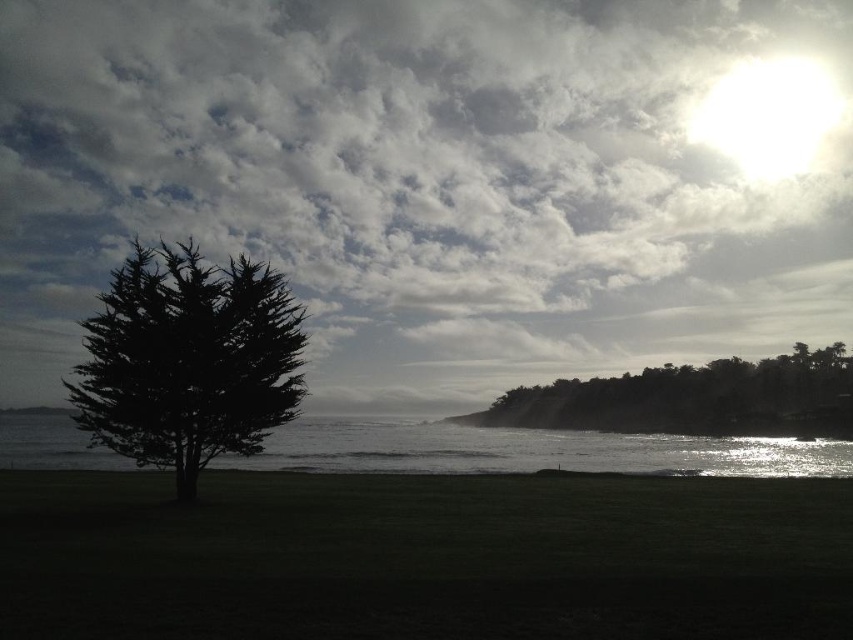
You are a photographer wanting to capture the entire scene in one shot. Given that your camera can only focus on one object at a time, which object between the glistening silver water at center and the dark green textured trees at lower right should you choose to ensure the larger object is in focus?

The glistening silver water at center is larger in size than the dark green textured trees at lower right, so you should focus on the glistening silver water at center to ensure the larger object is in focus.

You are an artist sketching the coastal scene. You want to ensure the black matte tree at left and the dark green textured trees at lower right are proportionally accurate. Based on the scene, which tree should you draw wider in your sketch?

The black matte tree at left should be drawn wider than the dark green textured trees at lower right according to the scene description.